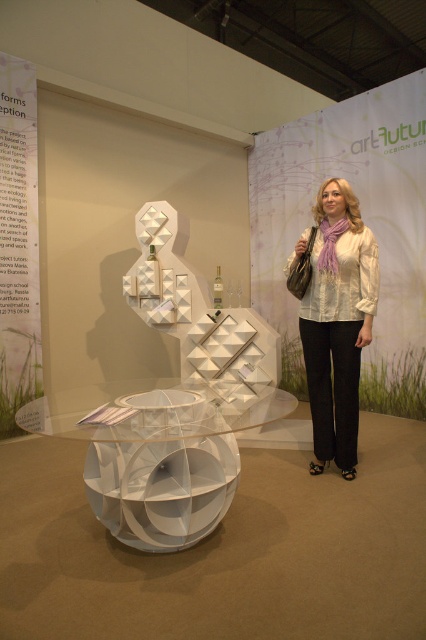
Question: Which object appears farthest from the camera in this image?

Choices:
 (A) white sheer blouse at center
 (B) white matte sculpture at center

Answer: (B)

Question: Which object appears closest to the camera in this image?

Choices:
 (A) white matte sculpture at center
 (B) white sheer blouse at center

Answer: (B)

Question: Does white matte sculpture at center appear under white sheer blouse at center?

Choices:
 (A) no
 (B) yes

Answer: (A)

Question: Is white matte sculpture at center bigger than white sheer blouse at center?

Choices:
 (A) no
 (B) yes

Answer: (B)

Question: Does white matte sculpture at center lie behind white sheer blouse at center?

Choices:
 (A) no
 (B) yes

Answer: (B)